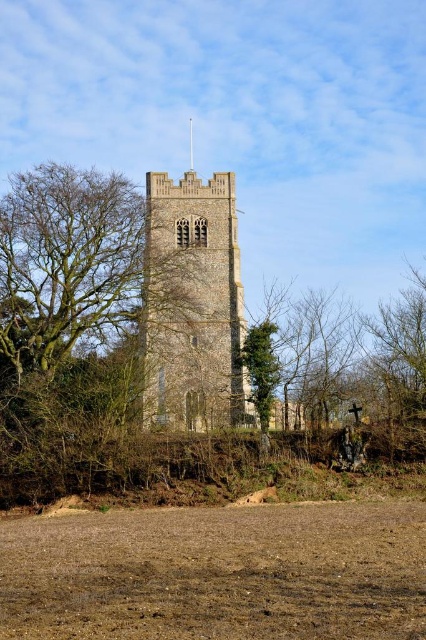
Who is shorter, brown soil at lower center or green leafy tree at center?

With less height is brown soil at lower center.

Does brown soil at lower center have a lesser height compared to green leafy tree at center?

Yes.

Between point (276, 548) and point (270, 365), which one is positioned in front?

Point (276, 548) is more forward.

I want to click on brown soil at lower center, so click(x=216, y=573).

Which is above, stone tower at center or green leafy tree at center?

stone tower at center is higher up.

Between point (198, 300) and point (259, 356), which one is positioned in front?

Point (259, 356) is in front.

The width and height of the screenshot is (426, 640). I want to click on stone tower at center, so (192, 304).

Is brown soil at lower center below stone tower at center?

Yes, brown soil at lower center is below stone tower at center.

Can you confirm if brown soil at lower center is smaller than stone tower at center?

No.

Between point (336, 548) and point (235, 362), which one is positioned in front?

Point (336, 548) is in front.

The width and height of the screenshot is (426, 640). What are the coordinates of `brown soil at lower center` in the screenshot? It's located at (216, 573).